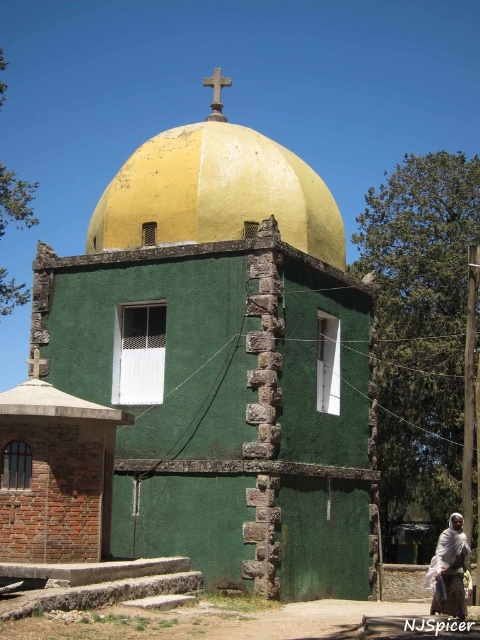
Who is higher up, green stone church at center or white textured cloth at lower right?

green stone church at center is higher up.

Is green stone church at center thinner than white textured cloth at lower right?

Incorrect, green stone church at center's width is not less than white textured cloth at lower right's.

Which is in front, point (83, 316) or point (441, 573)?

Point (441, 573)

Where is `green stone church at center`? The width and height of the screenshot is (480, 640). green stone church at center is located at coordinates (224, 362).

Who is more distant from viewer, (240, 148) or (444, 598)?

The point (240, 148) is behind.

How much distance is there between yellow matte dome at center and white textured cloth at lower right?

yellow matte dome at center is 81.31 feet from white textured cloth at lower right.

Locate an element on the screen. This screenshot has height=640, width=480. yellow matte dome at center is located at coordinates (216, 193).

Where is `yellow matte dome at center`? Image resolution: width=480 pixels, height=640 pixels. yellow matte dome at center is located at coordinates (216, 193).

Who is lower down, white textured cloth at lower right or smooth stone cross at upper center?

white textured cloth at lower right is lower down.

Which is behind, point (447, 604) or point (220, 106)?

The point (220, 106) is behind.

What do you see at coordinates (450, 570) in the screenshot? I see `white textured cloth at lower right` at bounding box center [450, 570].

This screenshot has height=640, width=480. In order to click on white textured cloth at lower right in this screenshot , I will do `click(450, 570)`.